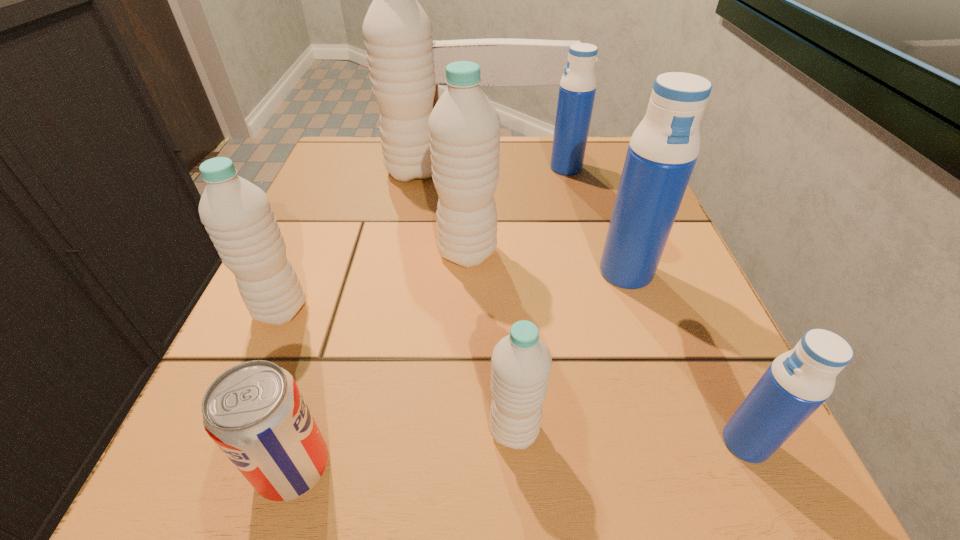
The height and width of the screenshot is (540, 960). I want to click on free point between the biggest blue water bottle and the leftmost object, so click(453, 291).

Image resolution: width=960 pixels, height=540 pixels. What are the coordinates of `vacant point located between the leftmost water bottle and the second smallest blue water bottle` in the screenshot? It's located at (423, 239).

Where is `free space between the tallest water bottle and the second farthest blue water bottle`? This screenshot has height=540, width=960. free space between the tallest water bottle and the second farthest blue water bottle is located at coordinates [x=519, y=222].

Locate an element on the screen. vacant region between the second farthest blue water bottle and the smallest white water bottle is located at coordinates (570, 351).

At what (x,y) coordinates should I click in order to perform the action: click on free space that is in between the third nearest white water bottle and the shortest object. Please return your answer as a coordinate pair (x, y). The width and height of the screenshot is (960, 540). Looking at the image, I should click on (380, 360).

Find the location of `unoccupied area between the third nearest white water bottle and the rightmost object`. unoccupied area between the third nearest white water bottle and the rightmost object is located at coordinates (607, 348).

Locate an element on the screen. This screenshot has height=540, width=960. vacant area between the second farthest white water bottle and the farthest blue water bottle is located at coordinates (516, 210).

Locate which object ranks fifth in proximity to the soda. Please provide its 2D coordinates. Your answer should be formatted as a tuple, i.e. [(x, y)], where the tuple contains the x and y coordinates of a point satisfying the conditions above.

[(799, 381)]

Locate which object is the fifth closest to the second farthest white water bottle. Please provide its 2D coordinates. Your answer should be formatted as a tuple, i.e. [(x, y)], where the tuple contains the x and y coordinates of a point satisfying the conditions above.

[(521, 364)]

At what (x,y) coordinates should I click in order to perform the action: click on water bottle that is the fourth closest to the soda. Please return your answer as a coordinate pair (x, y). Image resolution: width=960 pixels, height=540 pixels. Looking at the image, I should click on coord(663,150).